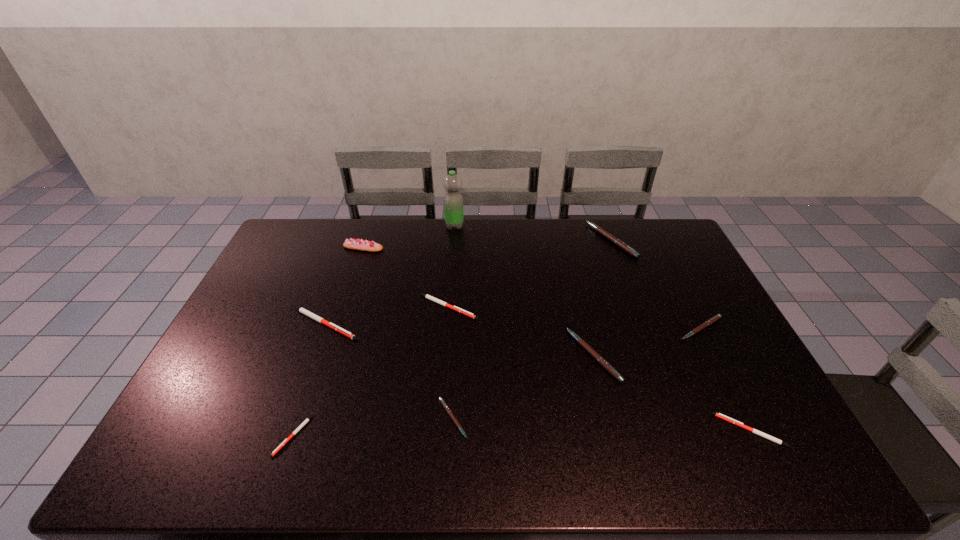
I want to click on object that ranks as the seventh closest to the second biggest white pen, so click(x=619, y=243).

Point out which object is positioned as the fifth nearest to the rightmost white pen. Please provide its 2D coordinates. Your answer should be formatted as a tuple, i.e. [(x, y)], where the tuple contains the x and y coordinates of a point satisfying the conditions above.

[(427, 296)]

At what (x,y) coordinates should I click in order to perform the action: click on pen that can be found as the sixth closest to the green water bottle. Please return your answer as a coordinate pair (x, y). Looking at the image, I should click on (717, 317).

The image size is (960, 540). In order to click on pen that is the fourth closest one to the shortest object in this screenshot , I will do `click(580, 341)`.

Point out which pink pen is positioned as the second nearest to the nearest pink pen. Please provide its 2D coordinates. Your answer should be formatted as a tuple, i.e. [(x, y)], where the tuple contains the x and y coordinates of a point satisfying the conditions above.

[(717, 317)]

Identify which pink pen is the third closest to the second smallest pink pen. Please provide its 2D coordinates. Your answer should be formatted as a tuple, i.e. [(x, y)], where the tuple contains the x and y coordinates of a point satisfying the conditions above.

[(447, 409)]

Identify which white pen is the fourth nearest to the second pink pen from right to left. Please provide its 2D coordinates. Your answer should be formatted as a tuple, i.e. [(x, y)], where the tuple contains the x and y coordinates of a point satisfying the conditions above.

[(286, 440)]

Select which white pen is the second closest to the rightmost white pen. Please provide its 2D coordinates. Your answer should be formatted as a tuple, i.e. [(x, y)], where the tuple contains the x and y coordinates of a point satisfying the conditions above.

[(302, 310)]

Find the location of a particular element. free space in the image that satisfies the following two spatial constraints: 1. at the nib of the second smallest pink pen; 2. at the nib of the smallest pink pen is located at coordinates (746, 418).